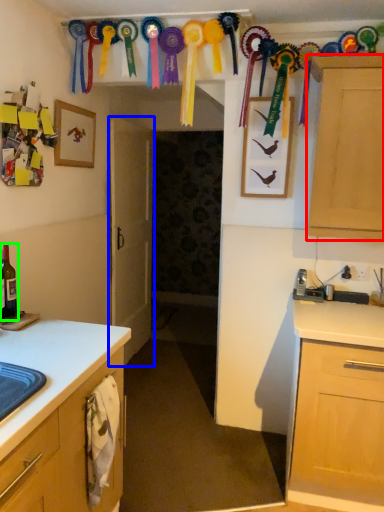
Question: Which object is positioned closest to cabinetry (highlighted by a red box)? Select from door (highlighted by a blue box) and beer bottle (highlighted by a green box).

Choices:
 (A) door
 (B) beer bottle

Answer: (B)